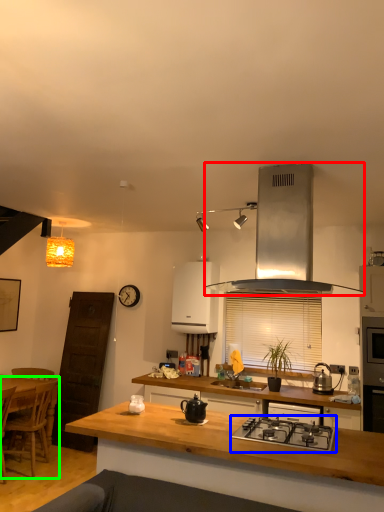
Question: Based on their relative distances, which object is nearer to kitchen appliance (highlighted by a red box)? Choose from gas stove (highlighted by a blue box) and chair (highlighted by a green box).

Choices:
 (A) gas stove
 (B) chair

Answer: (A)